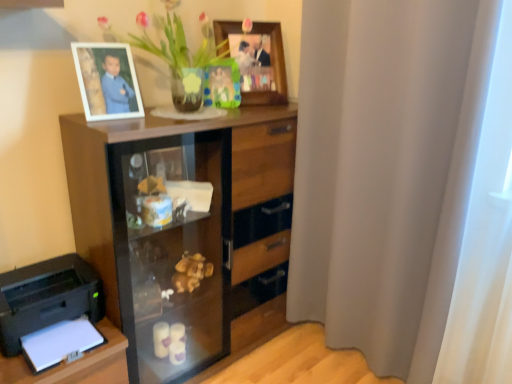
The height and width of the screenshot is (384, 512). Describe the element at coordinates (407, 185) in the screenshot. I see `white fabric curtain at right` at that location.

Describe the element at coordinates (272, 65) in the screenshot. I see `wooden picture frame at upper center, the first picture frame viewed from the right` at that location.

What is the approximate width of translucent glass vase at upper center?

translucent glass vase at upper center is 18.70 inches in width.

Describe the element at coordinates (183, 228) in the screenshot. This screenshot has width=512, height=384. I see `wooden cabinet at center` at that location.

Find the location of `wooden cabinet at center`. wooden cabinet at center is located at coordinates coord(183,228).

Image resolution: width=512 pixels, height=384 pixels. Find the location of `white fabric curtain at right`. white fabric curtain at right is located at coordinates (x=407, y=185).

This screenshot has height=384, width=512. What are the coordinates of `curtain that is below the translucent glass vase at upper center (from the image's perspective)` in the screenshot? It's located at (407, 185).

Who is taller, white fabric curtain at right or translucent glass vase at upper center?

white fabric curtain at right is taller.

From a real-world perspective, which is physically above, white fabric curtain at right or translucent glass vase at upper center?

translucent glass vase at upper center is physically above.

Is green matte picture frame at upper center, arranged as the 3th picture frame when viewed from the front, positioned before wooden cabinet at center?

No, green matte picture frame at upper center, arranged as the 3th picture frame when viewed from the front, is further to the viewer.

Is green matte picture frame at upper center, which is the 2th picture frame from right to left, looking in the opposite direction of wooden cabinet at center?

green matte picture frame at upper center, which is the 2th picture frame from right to left, does not have its back to wooden cabinet at center.

Is green matte picture frame at upper center, arranged as the 3th picture frame when viewed from the front, smaller than wooden cabinet at center?

Yes.

Where is `chest of drawers to the left of green matte picture frame at upper center, arranged as the 2th picture frame when viewed from the left`? The height and width of the screenshot is (384, 512). chest of drawers to the left of green matte picture frame at upper center, arranged as the 2th picture frame when viewed from the left is located at coordinates (183, 228).

Is white fabric curtain at right turned away from green matte picture frame at upper center, which is the 2th picture frame from right to left?

No.

In the scene shown: From the image's perspective, does white fabric curtain at right appear lower than green matte picture frame at upper center, arranged as the 3th picture frame when viewed from the front?

Indeed, from the image's perspective, white fabric curtain at right is shown beneath green matte picture frame at upper center, arranged as the 3th picture frame when viewed from the front.

How many degrees apart are the facing directions of white fabric curtain at right and green matte picture frame at upper center, arranged as the 2th picture frame when viewed from the left?

63 degrees.

Do you think white fabric curtain at right is within green matte picture frame at upper center, which is the 2th picture frame from right to left, or outside of it?

white fabric curtain at right exists outside the volume of green matte picture frame at upper center, which is the 2th picture frame from right to left.

Does translucent glass vase at upper center have a larger size compared to wooden cabinet at center?

Incorrect, translucent glass vase at upper center is not larger than wooden cabinet at center.

Is translucent glass vase at upper center thinner than wooden cabinet at center?

Yes, translucent glass vase at upper center is thinner than wooden cabinet at center.

Can wooden cabinet at center be found inside translucent glass vase at upper center?

No, wooden cabinet at center is not a part of translucent glass vase at upper center.

In the scene shown: Is translucent glass vase at upper center further to the viewer compared to wooden cabinet at center?

No, it is not.

From the picture: Which object is positioned more to the left, white matte picture frame at upper left, the first picture frame in the front-to-back sequence, or green matte picture frame at upper center, arranged as the 2th picture frame when viewed from the left?

Positioned to the left is white matte picture frame at upper left, the first picture frame in the front-to-back sequence.

Can you see white matte picture frame at upper left, which ranks as the 3th picture frame in back-to-front order, touching green matte picture frame at upper center, placed as the first picture frame when sorted from back to front?

No, white matte picture frame at upper left, which ranks as the 3th picture frame in back-to-front order, is not beside green matte picture frame at upper center, placed as the first picture frame when sorted from back to front.

Is white matte picture frame at upper left, the 3th picture frame in the right-to-left sequence, facing towards green matte picture frame at upper center, placed as the first picture frame when sorted from back to front?

No, white matte picture frame at upper left, the 3th picture frame in the right-to-left sequence, is not turned towards green matte picture frame at upper center, placed as the first picture frame when sorted from back to front.

Which is farther from the camera, (x=100, y=83) or (x=208, y=87)?

The point (x=208, y=87) is behind.

Is wooden cabinet at center in front of or behind green matte picture frame at upper center, which is the 2th picture frame from right to left, in the image?

Clearly, wooden cabinet at center is in front of green matte picture frame at upper center, which is the 2th picture frame from right to left.

In the scene shown: Considering the sizes of objects wooden cabinet at center and green matte picture frame at upper center, placed as the first picture frame when sorted from back to front, in the image provided, who is wider, wooden cabinet at center or green matte picture frame at upper center, placed as the first picture frame when sorted from back to front,?

wooden cabinet at center.

Is wooden cabinet at center aimed at green matte picture frame at upper center, placed as the first picture frame when sorted from back to front?

No.

Who is shorter, wooden cabinet at center or green matte picture frame at upper center, arranged as the 3th picture frame when viewed from the front?

With less height is green matte picture frame at upper center, arranged as the 3th picture frame when viewed from the front.

Is white fabric curtain at right far away from wooden cabinet at center?

No, white fabric curtain at right is not far away from wooden cabinet at center.

There is a wooden cabinet at center. Where is `curtain above it (from a real-world perspective)`? curtain above it (from a real-world perspective) is located at coordinates (407, 185).

Locate an element on the screen. This screenshot has height=384, width=512. curtain on the right of translucent glass vase at upper center is located at coordinates (407, 185).

Find the location of a particular element. picture frame that is the 3rd object located behind the wooden cabinet at center is located at coordinates (222, 84).

Based on their spatial positions, is wooden picture frame at upper center, the first picture frame viewed from the right, or wooden cabinet at center closer to black plastic printer at lower left?

wooden cabinet at center lies closer to black plastic printer at lower left than the other object.

Estimate the real-world distances between objects in this image. Which object is further from wooden cabinet at center, black plastic printer at lower left or translucent glass vase at upper center?

translucent glass vase at upper center is positioned further to the anchor wooden cabinet at center.

Which object lies further to the anchor point black plastic printer at lower left, white fabric curtain at right or wooden picture frame at upper center, the 3th picture frame in the left-to-right sequence?

Based on the image, white fabric curtain at right appears to be further to black plastic printer at lower left.

Estimate the real-world distances between objects in this image. Which object is closer to white fabric curtain at right, green matte picture frame at upper center, arranged as the 3th picture frame when viewed from the front, or translucent glass vase at upper center?

Among the two, translucent glass vase at upper center is located nearer to white fabric curtain at right.

Based on their spatial positions, is translucent glass vase at upper center or white fabric curtain at right further from black plastic printer at lower left?

The object further to black plastic printer at lower left is white fabric curtain at right.

Which object lies nearer to the anchor point white fabric curtain at right, black plastic printer at lower left or white matte picture frame at upper left, the 3th picture frame in the right-to-left sequence?

white matte picture frame at upper left, the 3th picture frame in the right-to-left sequence.

When comparing their distances from translucent glass vase at upper center, does white matte picture frame at upper left, the first picture frame in the front-to-back sequence, or wooden cabinet at center seem further?

wooden cabinet at center lies further to translucent glass vase at upper center than the other object.

Considering their positions, is white fabric curtain at right positioned closer to translucent glass vase at upper center than black plastic printer at lower left?

white fabric curtain at right is positioned closer to the anchor translucent glass vase at upper center.

Locate an element on the screen. chest of drawers between white matte picture frame at upper left, the 3th picture frame in the right-to-left sequence, and white fabric curtain at right, in the horizontal direction is located at coordinates (183, 228).

Find the location of a particular element. The height and width of the screenshot is (384, 512). the chest of drawers between wooden picture frame at upper center, the first picture frame viewed from the right, and black plastic printer at lower left vertically is located at coordinates (183, 228).

Where is `floral arrangement between wooden picture frame at upper center, the 3th picture frame in the left-to-right sequence, and black plastic printer at lower left vertically`? Image resolution: width=512 pixels, height=384 pixels. floral arrangement between wooden picture frame at upper center, the 3th picture frame in the left-to-right sequence, and black plastic printer at lower left vertically is located at coordinates (175, 52).

This screenshot has width=512, height=384. Identify the location of chest of drawers between translucent glass vase at upper center and white fabric curtain at right from left to right. (183, 228).